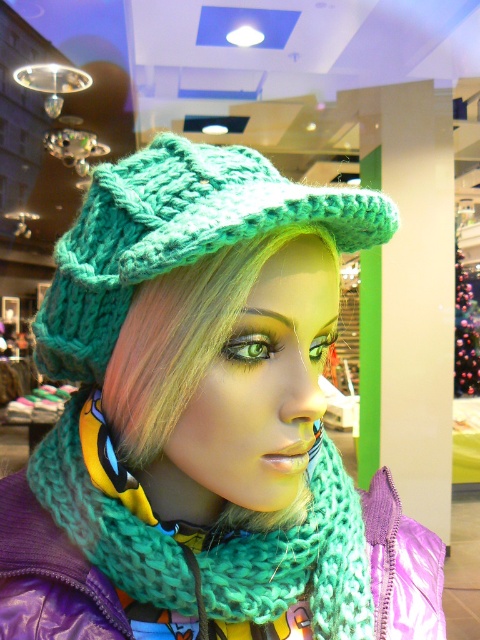
Does teal knitted scarf at center have a greater height compared to green knitted hat at center?

In fact, teal knitted scarf at center may be shorter than green knitted hat at center.

Is point (101, 544) positioned before point (227, 202)?

No.

Image resolution: width=480 pixels, height=640 pixels. What do you see at coordinates (206, 538) in the screenshot? I see `teal knitted scarf at center` at bounding box center [206, 538].

I want to click on teal knitted scarf at center, so click(x=206, y=538).

Does point (220, 220) come in front of point (216, 246)?

That is False.

Is knitted teal hat at center above green knitted hat at center?

Actually, knitted teal hat at center is below green knitted hat at center.

Is point (249, 579) farther from camera compared to point (260, 184)?

Yes.

Find the location of `knitted teal hat at center`. knitted teal hat at center is located at coordinates (204, 419).

Describe the element at coordinates (204, 419) in the screenshot. This screenshot has width=480, height=640. I see `knitted teal hat at center` at that location.

Does knitted teal hat at center appear on the right side of teal knitted scarf at center?

No, knitted teal hat at center is not to the right of teal knitted scarf at center.

The height and width of the screenshot is (640, 480). What do you see at coordinates (204, 419) in the screenshot? I see `knitted teal hat at center` at bounding box center [204, 419].

Image resolution: width=480 pixels, height=640 pixels. I want to click on knitted teal hat at center, so click(x=204, y=419).